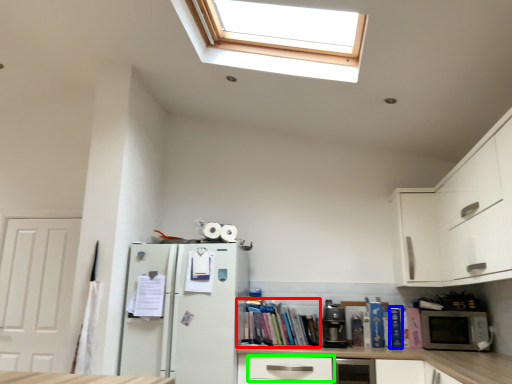
Question: Based on their relative distances, which object is nearer to book (highlighted by a red box)? Choose from book (highlighted by a blue box) and drawer (highlighted by a green box).

Choices:
 (A) book
 (B) drawer

Answer: (B)